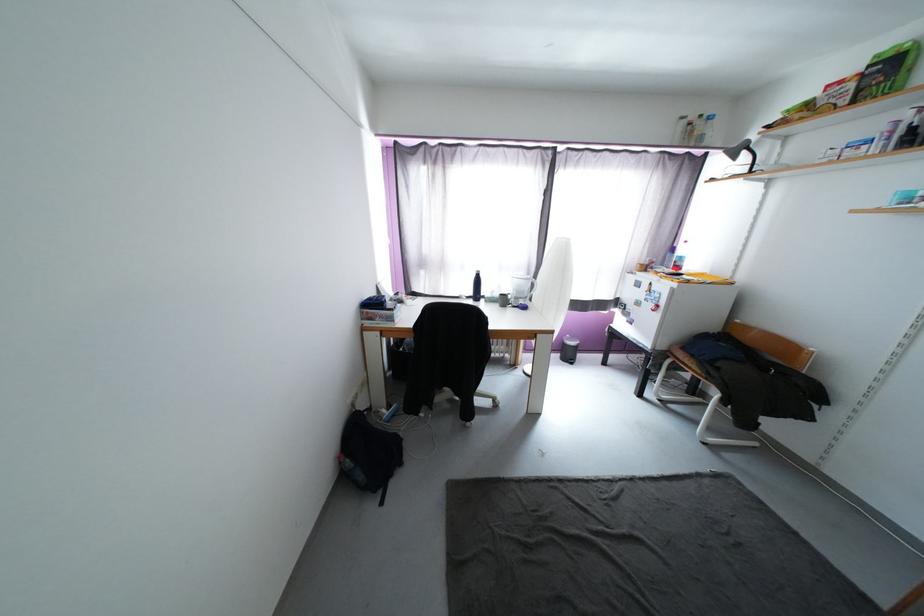
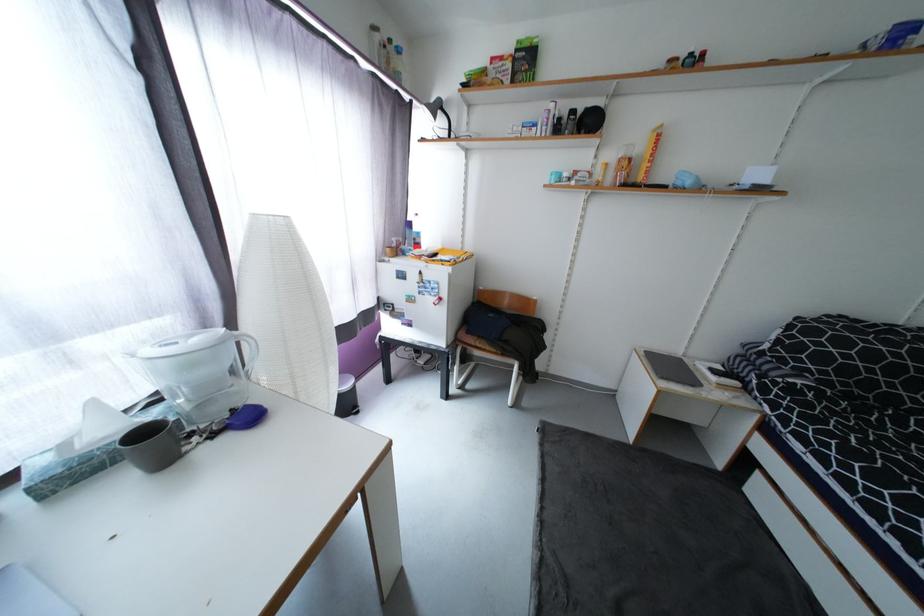
Where in the second image is the point corresponding to point (650, 288) from the first image?

(419, 278)